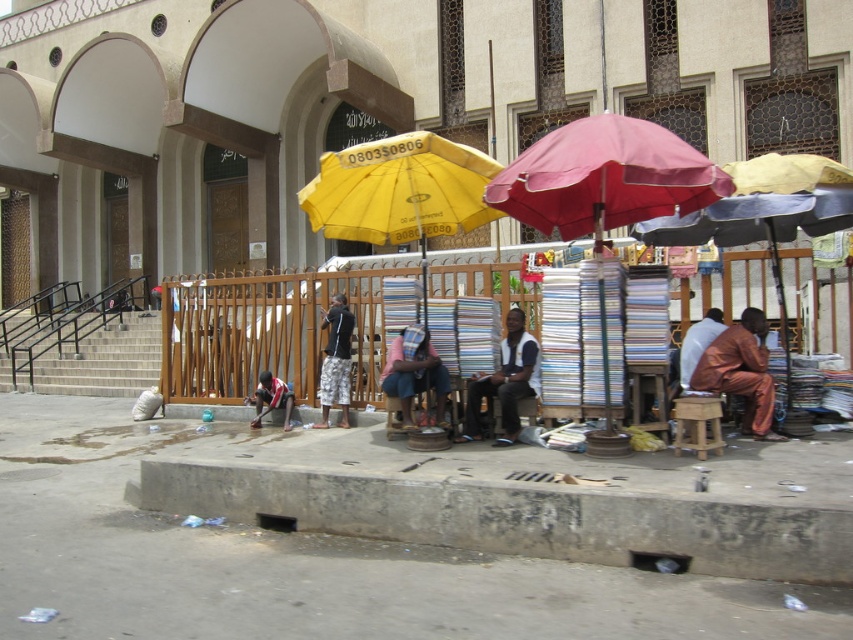
Question: Can you confirm if dark blue fabric at center is positioned to the left of dark gray fabric pants at center?

Choices:
 (A) yes
 (B) no

Answer: (B)

Question: Which point appears closest to the camera in this image?

Choices:
 (A) (339, 401)
 (B) (733, 387)
 (C) (286, 429)

Answer: (B)

Question: Can you confirm if yellow fabric umbrella at center is positioned above matte red umbrella at center?

Choices:
 (A) no
 (B) yes

Answer: (B)

Question: Which point is closer to the camera taking this photo?

Choices:
 (A) (462, 438)
 (B) (334, 376)
 (C) (683, 397)
 (D) (368, 570)

Answer: (D)

Question: Which of these objects is positioned closest to the concrete stairs at left?

Choices:
 (A) yellow fabric umbrella at center
 (B) wooden stool at center
 (C) red fabric umbrella at center
 (D) matte red umbrella at center

Answer: (A)

Question: Where is red fabric umbrella at center located in relation to matte red umbrella at center in the image?

Choices:
 (A) right
 (B) left

Answer: (B)